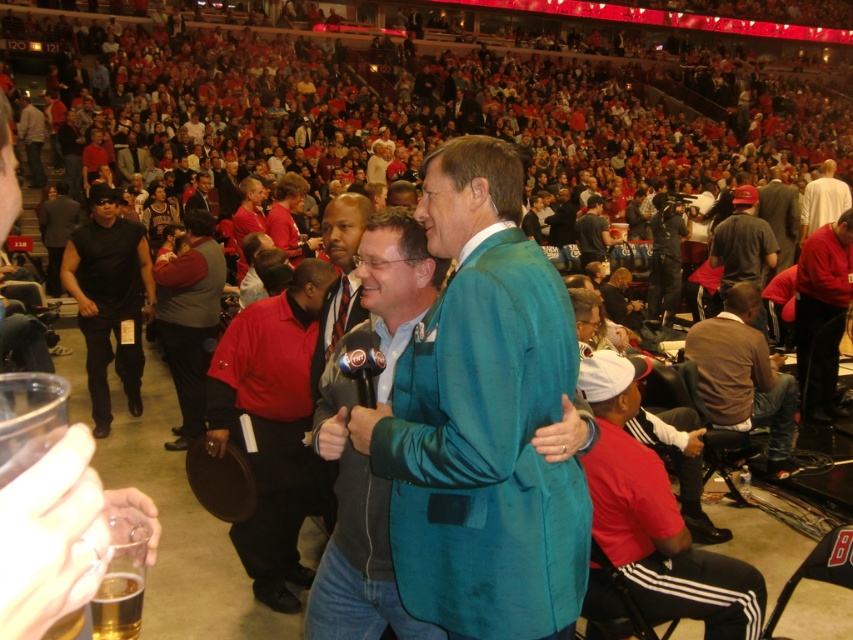
Question: Which point appears closest to the camera in this image?

Choices:
 (A) (109, 412)
 (B) (593, 230)
 (C) (811, 307)

Answer: (C)

Question: Is teal fabric jacket at center smaller than brown cotton shirt at lower right?

Choices:
 (A) yes
 (B) no

Answer: (A)

Question: Can you confirm if teal satin blazer at center is thinner than metallic silver microphone at center?

Choices:
 (A) no
 (B) yes

Answer: (A)

Question: Can you confirm if black sleeveless shirt at left is positioned below matte black jacket at center?

Choices:
 (A) no
 (B) yes

Answer: (B)

Question: Which of these objects is positioned farthest from the teal leather jacket at center?

Choices:
 (A) red smooth shirt at center
 (B) brown cotton shirt at lower right

Answer: (A)

Question: Among these points, which one is nearest to the camera?

Choices:
 (A) (38, 134)
 (B) (724, 320)

Answer: (B)